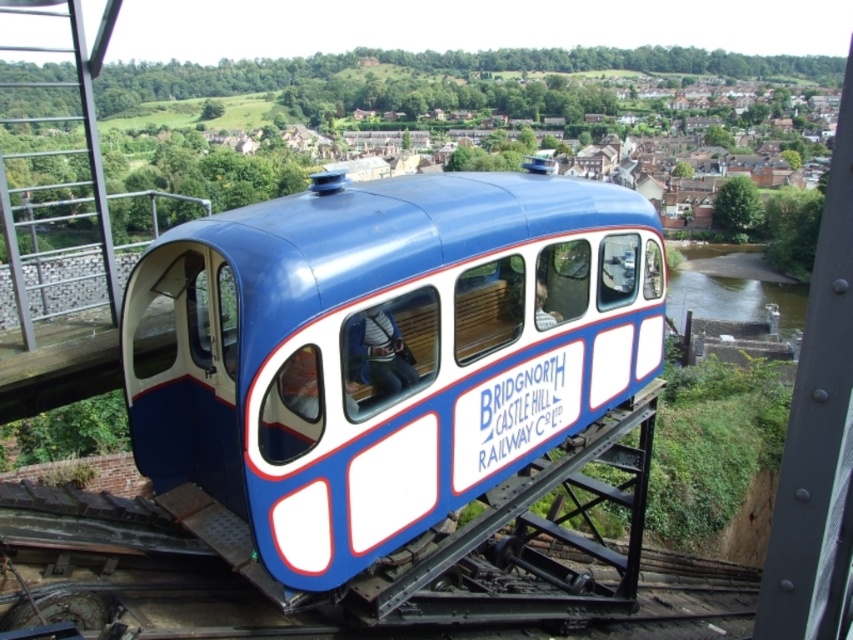
You are a passenger on the Bridgnorth Castle Hill Railway Co Ltd. You notice two vehicles, the blue glossy train car at center and the matte blue coach at center. Which one has more seats available for passengers?

The blue glossy train car at center is bigger than the matte blue coach at center, so it likely has more seats available for passengers.

You are a passenger on the matte blue coach at center and want to look out the window to see the green smooth water at lower right. Is the water closer to you or farther away than the coach?

The green smooth water at lower right is further to the viewer than the matte blue coach at center, so the water is farther away than the coach.